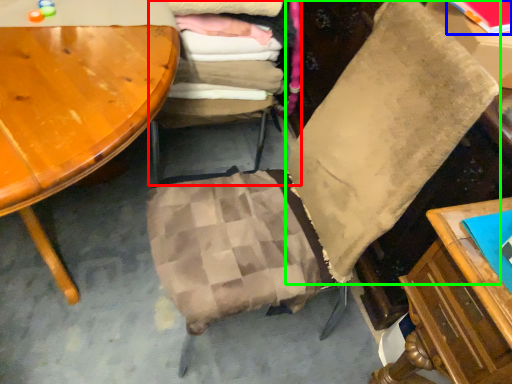
Question: Which object is the closest to the chair (highlighted by a red box)? Choose among these: book (highlighted by a blue box) or pillow (highlighted by a green box).

Choices:
 (A) book
 (B) pillow

Answer: (B)